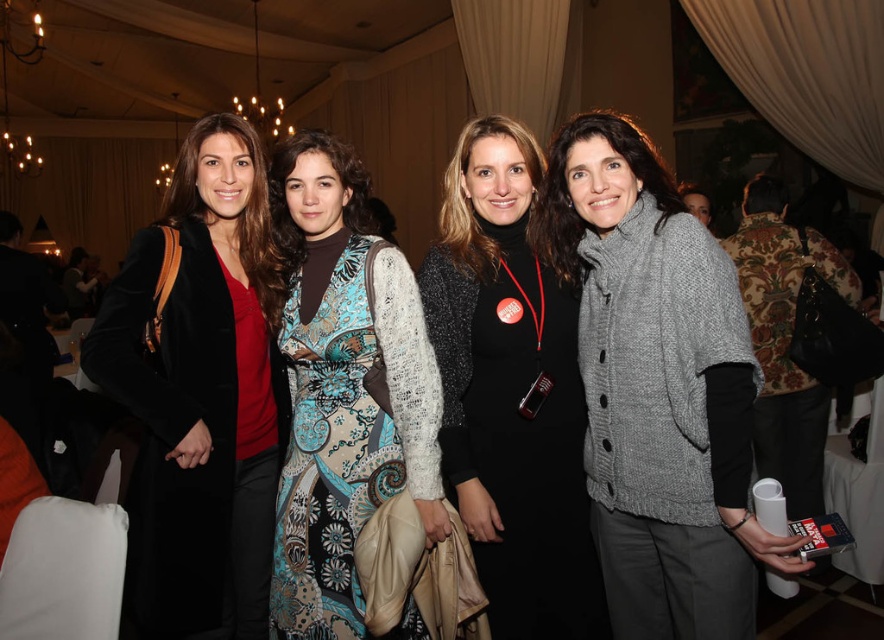
Question: Which object is positioned farthest from the patterned fabric dress at center?

Choices:
 (A) black glitter dress at center
 (B) matte black coat at left

Answer: (A)

Question: Considering the relative positions of knitted gray sweater at center and black glitter dress at center in the image provided, where is knitted gray sweater at center located with respect to black glitter dress at center?

Choices:
 (A) below
 (B) above

Answer: (B)

Question: Is matte black coat at left thinner than black glitter dress at center?

Choices:
 (A) no
 (B) yes

Answer: (A)

Question: Considering the real-world distances, which object is farthest from the knitted gray sweater at center?

Choices:
 (A) patterned fabric dress at center
 (B) matte black coat at left
 (C) black glitter dress at center

Answer: (B)

Question: Among these points, which one is nearest to the camera?

Choices:
 (A) (153, 557)
 (B) (332, 570)

Answer: (A)

Question: Is knitted gray sweater at center thinner than black glitter dress at center?

Choices:
 (A) no
 (B) yes

Answer: (B)